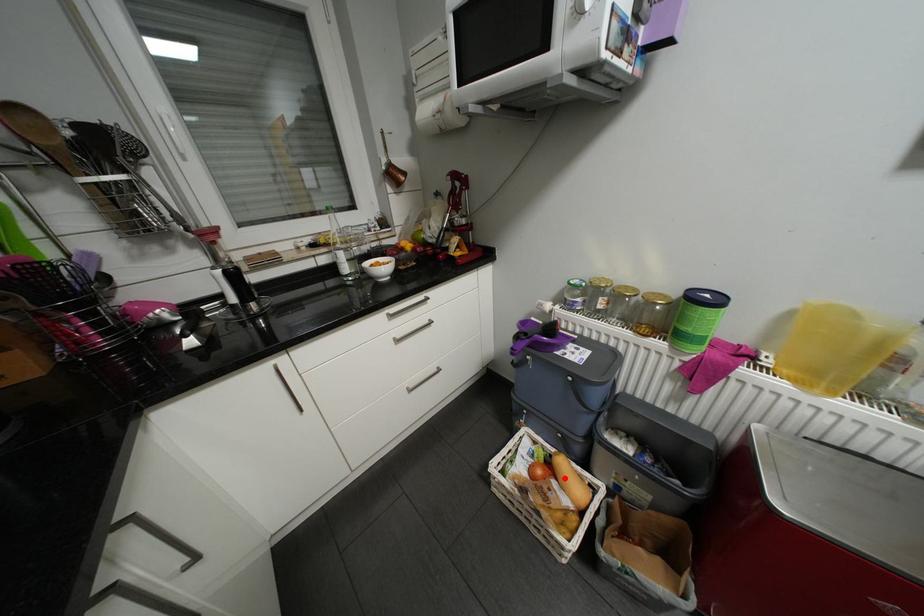
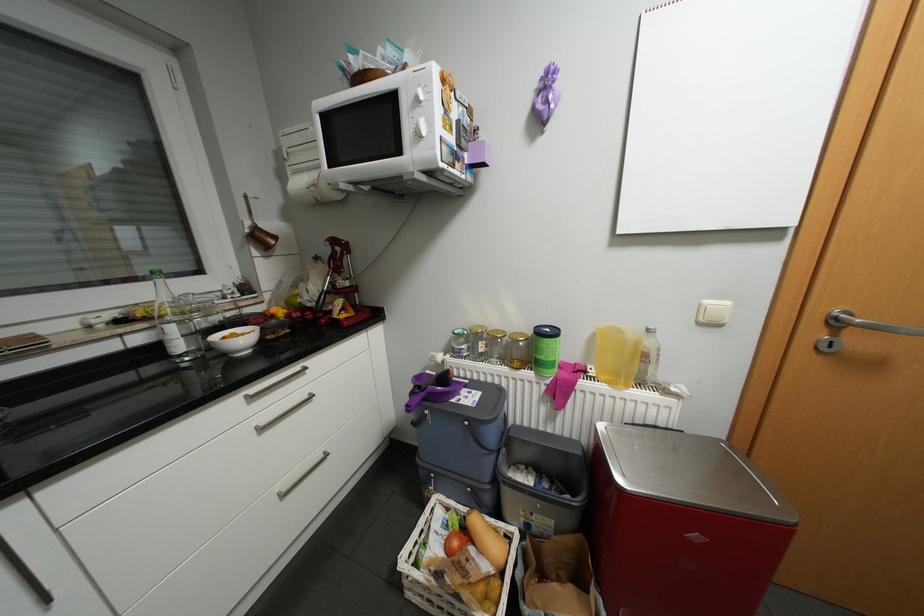
Question: I am providing you with two images of the same scene from different viewpoints. A red point is shown in image1. For the corresponding object point in image2, is it positioned nearer or farther from the camera?

Choices:
 (A) Nearer
 (B) Farther

Answer: (B)